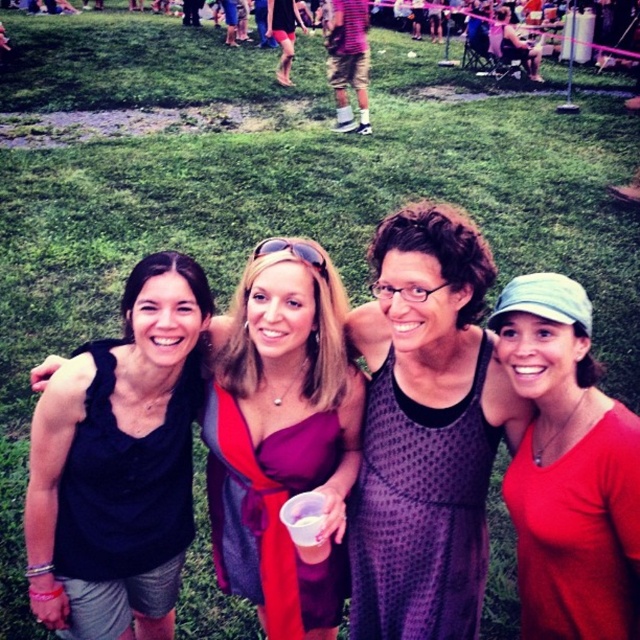
Can you confirm if purple mesh dress at center is wider than burgundy satin dress at center?

No, purple mesh dress at center is not wider than burgundy satin dress at center.

At what (x,y) coordinates should I click in order to perform the action: click on purple mesh dress at center. Please return your answer as a coordinate pair (x, y). Looking at the image, I should click on (419, 513).

Does black fabric dress at center have a smaller size compared to burgundy satin dress at center?

No, black fabric dress at center is not smaller than burgundy satin dress at center.

Find the location of `black fabric dress at center`. black fabric dress at center is located at coordinates (282, 435).

The image size is (640, 640). I want to click on black fabric dress at center, so click(282, 435).

Between point (625, 618) and point (404, 608), which one is positioned in front?

Positioned in front is point (625, 618).

Does red matte shirt at center appear on the left side of purple mesh dress at center?

No, red matte shirt at center is not to the left of purple mesh dress at center.

Who is more forward, (628, 506) or (432, 611)?

Positioned in front is point (628, 506).

Locate an element on the screen. The image size is (640, 640). red matte shirt at center is located at coordinates (568, 468).